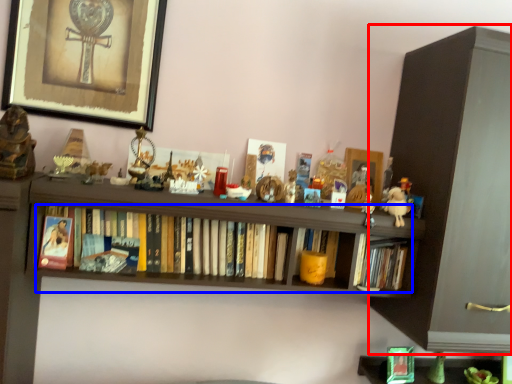
Question: Which object is closer to the camera taking this photo, cabinetry (highlighted by a red box) or book (highlighted by a blue box)?

Choices:
 (A) cabinetry
 (B) book

Answer: (B)